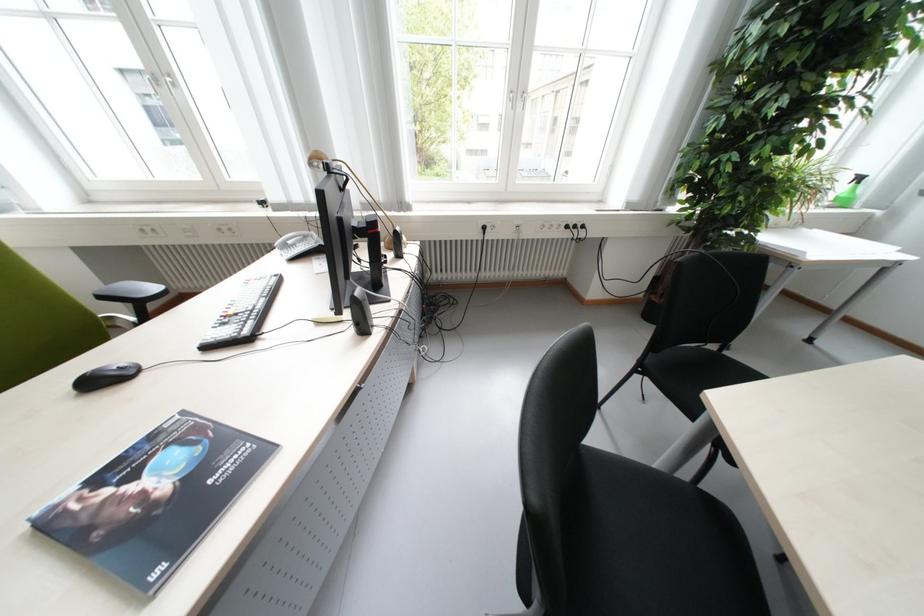
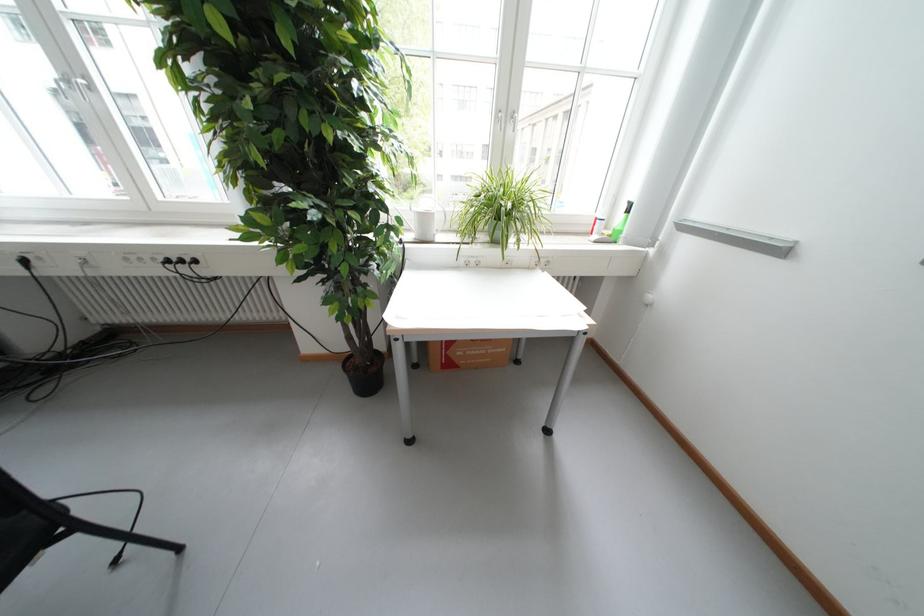
Find the pixel in the second image that matches the point at 578,228 in the first image.

(177, 262)